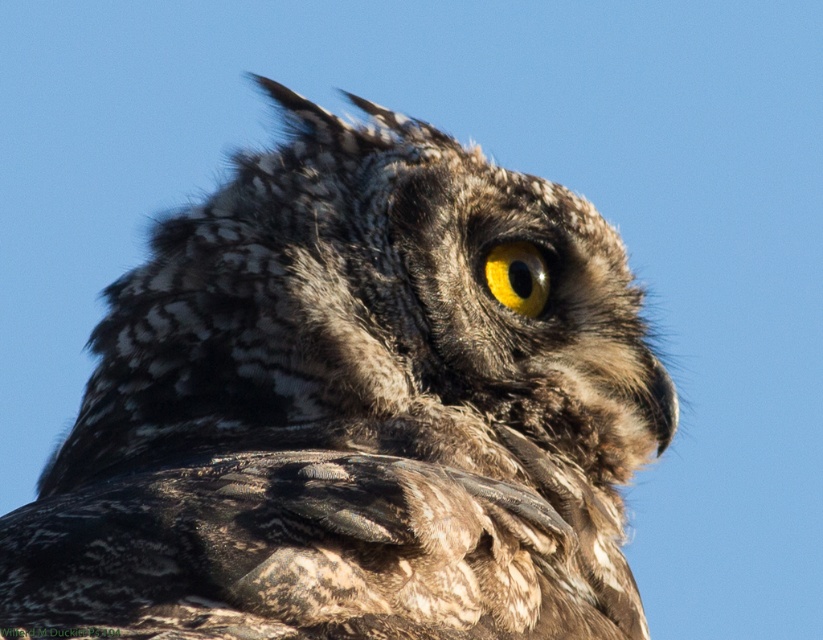
Question: Which point is farther to the camera?

Choices:
 (A) (224, 468)
 (B) (542, 259)

Answer: (B)

Question: Observing the image, what is the correct spatial positioning of speckled feathered owl at center in reference to yellow matte eye at center?

Choices:
 (A) above
 (B) below

Answer: (B)

Question: Which of the following is the closest to the observer?

Choices:
 (A) yellow matte eye at center
 (B) speckled feathered owl at center

Answer: (B)

Question: Which point is farther to the camera?

Choices:
 (A) speckled feathered owl at center
 (B) yellow matte eye at center

Answer: (B)

Question: In this image, where is speckled feathered owl at center located relative to yellow matte eye at center?

Choices:
 (A) above
 (B) below

Answer: (B)

Question: Is speckled feathered owl at center behind yellow matte eye at center?

Choices:
 (A) no
 (B) yes

Answer: (A)